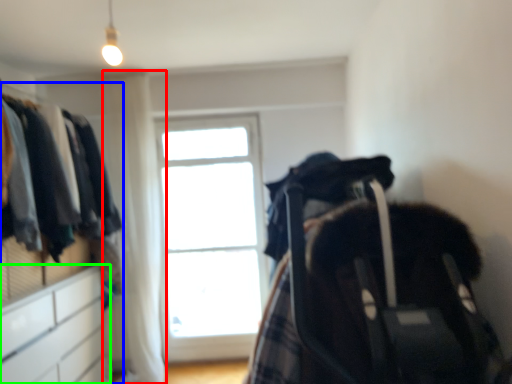
Question: Which is farther away from curtain (highlighted by a red box)? dresser (highlighted by a blue box) or file cabinet (highlighted by a green box)?

Choices:
 (A) dresser
 (B) file cabinet

Answer: (B)